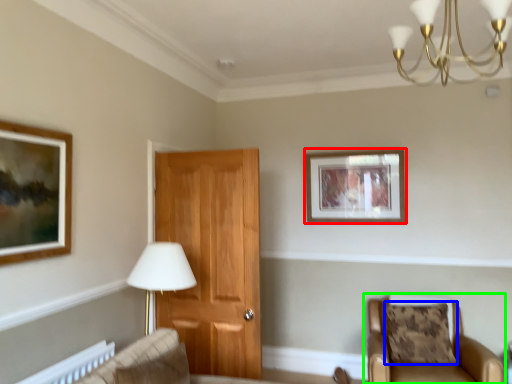
Question: Considering the real-world distances, which object is closest to picture frame (highlighted by a red box)? pillow (highlighted by a blue box) or chair (highlighted by a green box).

Choices:
 (A) pillow
 (B) chair

Answer: (A)